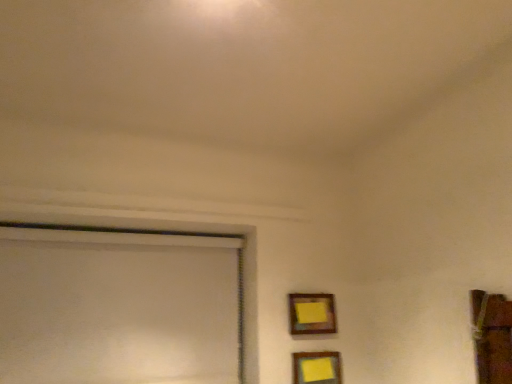
Find the location of a particular element. This screenshot has width=512, height=384. wooden frame at lower right, positioned as the 2th picture frame in bottom-to-top order is located at coordinates (312, 314).

The width and height of the screenshot is (512, 384). What do you see at coordinates (312, 314) in the screenshot?
I see `wooden frame at lower right, positioned as the 2th picture frame in bottom-to-top order` at bounding box center [312, 314].

Describe the element at coordinates (317, 368) in the screenshot. I see `wooden framed picture at lower center, marked as the second picture frame in a top-to-bottom arrangement` at that location.

Find the location of a particular element. wooden framed picture at lower center, the 1th picture frame positioned from the bottom is located at coordinates click(x=317, y=368).

Based on the photo, what is the approximate width of wooden framed picture at lower center, marked as the second picture frame in a top-to-bottom arrangement?

wooden framed picture at lower center, marked as the second picture frame in a top-to-bottom arrangement, is 1.39 inches in width.

The image size is (512, 384). Find the location of `wooden frame at lower right, the 1th picture frame viewed from the top`. wooden frame at lower right, the 1th picture frame viewed from the top is located at coordinates (312, 314).

In the image, is wooden frame at lower right, positioned as the 2th picture frame in bottom-to-top order, on the left side or the right side of wooden framed picture at lower center, marked as the second picture frame in a top-to-bottom arrangement?

From the image, it's evident that wooden frame at lower right, positioned as the 2th picture frame in bottom-to-top order, is to the left of wooden framed picture at lower center, marked as the second picture frame in a top-to-bottom arrangement.

Does wooden frame at lower right, the 1th picture frame viewed from the top, lie in front of wooden framed picture at lower center, marked as the second picture frame in a top-to-bottom arrangement?

No.

Between point (314, 307) and point (313, 361), which one is positioned in front?

Positioned in front is point (313, 361).

From the image's perspective, which one is positioned lower, wooden frame at lower right, the 1th picture frame viewed from the top, or wooden framed picture at lower center, marked as the second picture frame in a top-to-bottom arrangement?

wooden framed picture at lower center, marked as the second picture frame in a top-to-bottom arrangement, appears lower in the image.

From a real-world perspective, between wooden frame at lower right, positioned as the 2th picture frame in bottom-to-top order, and wooden framed picture at lower center, marked as the second picture frame in a top-to-bottom arrangement, who is vertically lower?

wooden framed picture at lower center, marked as the second picture frame in a top-to-bottom arrangement, from a real-world perspective.

Can you confirm if wooden frame at lower right, positioned as the 2th picture frame in bottom-to-top order, is wider than wooden framed picture at lower center, the 1th picture frame positioned from the bottom?

In fact, wooden frame at lower right, positioned as the 2th picture frame in bottom-to-top order, might be narrower than wooden framed picture at lower center, the 1th picture frame positioned from the bottom.

Who is taller, wooden frame at lower right, positioned as the 2th picture frame in bottom-to-top order, or wooden framed picture at lower center, marked as the second picture frame in a top-to-bottom arrangement?

wooden frame at lower right, positioned as the 2th picture frame in bottom-to-top order.

Who is bigger, wooden frame at lower right, the 1th picture frame viewed from the top, or wooden framed picture at lower center, marked as the second picture frame in a top-to-bottom arrangement?

Bigger between the two is wooden framed picture at lower center, marked as the second picture frame in a top-to-bottom arrangement.

Consider the image. Would you say wooden framed picture at lower center, marked as the second picture frame in a top-to-bottom arrangement, is part of wooden frame at lower right, positioned as the 2th picture frame in bottom-to-top order,'s contents?

Definitely not — wooden framed picture at lower center, marked as the second picture frame in a top-to-bottom arrangement, is not inside wooden frame at lower right, positioned as the 2th picture frame in bottom-to-top order.

Would you consider wooden frame at lower right, positioned as the 2th picture frame in bottom-to-top order, to be distant from wooden framed picture at lower center, marked as the second picture frame in a top-to-bottom arrangement?

Actually, wooden frame at lower right, positioned as the 2th picture frame in bottom-to-top order, and wooden framed picture at lower center, marked as the second picture frame in a top-to-bottom arrangement, are a little close together.

Is wooden frame at lower right, positioned as the 2th picture frame in bottom-to-top order, oriented away from wooden framed picture at lower center, marked as the second picture frame in a top-to-bottom arrangement?

No, wooden frame at lower right, positioned as the 2th picture frame in bottom-to-top order, is not facing the opposite direction of wooden framed picture at lower center, marked as the second picture frame in a top-to-bottom arrangement.

What's the angular difference between wooden frame at lower right, positioned as the 2th picture frame in bottom-to-top order, and wooden framed picture at lower center, the 1th picture frame positioned from the bottom,'s facing directions?

0.0037 degrees.

The width and height of the screenshot is (512, 384). Identify the location of picture frame to the right of wooden frame at lower right, the 1th picture frame viewed from the top. (317, 368).

Is wooden framed picture at lower center, marked as the second picture frame in a top-to-bottom arrangement, at the right side of wooden frame at lower right, positioned as the 2th picture frame in bottom-to-top order?

Correct, you'll find wooden framed picture at lower center, marked as the second picture frame in a top-to-bottom arrangement, to the right of wooden frame at lower right, positioned as the 2th picture frame in bottom-to-top order.

Between wooden framed picture at lower center, the 1th picture frame positioned from the bottom, and wooden frame at lower right, positioned as the 2th picture frame in bottom-to-top order, which one is positioned in front?

wooden framed picture at lower center, the 1th picture frame positioned from the bottom, is in front.

Between point (295, 356) and point (328, 308), which one is positioned behind?

The point (328, 308) is more distant.

From the image's perspective, would you say wooden framed picture at lower center, the 1th picture frame positioned from the bottom, is shown under wooden frame at lower right, the 1th picture frame viewed from the top?

Yes, from the image's perspective, wooden framed picture at lower center, the 1th picture frame positioned from the bottom, is beneath wooden frame at lower right, the 1th picture frame viewed from the top.

From a real-world perspective, is wooden framed picture at lower center, marked as the second picture frame in a top-to-bottom arrangement, positioned above or below wooden frame at lower right, the 1th picture frame viewed from the top?

wooden framed picture at lower center, marked as the second picture frame in a top-to-bottom arrangement, is situated lower than wooden frame at lower right, the 1th picture frame viewed from the top, in the real world.

Does wooden framed picture at lower center, the 1th picture frame positioned from the bottom, have a greater width compared to wooden frame at lower right, positioned as the 2th picture frame in bottom-to-top order?

Yes.

From their relative heights in the image, would you say wooden framed picture at lower center, the 1th picture frame positioned from the bottom, is taller or shorter than wooden frame at lower right, the 1th picture frame viewed from the top?

Clearly, wooden framed picture at lower center, the 1th picture frame positioned from the bottom, is shorter compared to wooden frame at lower right, the 1th picture frame viewed from the top.

Considering the sizes of objects wooden framed picture at lower center, the 1th picture frame positioned from the bottom, and wooden frame at lower right, positioned as the 2th picture frame in bottom-to-top order, in the image provided, who is bigger, wooden framed picture at lower center, the 1th picture frame positioned from the bottom, or wooden frame at lower right, positioned as the 2th picture frame in bottom-to-top order,?

Bigger between the two is wooden framed picture at lower center, the 1th picture frame positioned from the bottom.

Would you say wooden framed picture at lower center, marked as the second picture frame in a top-to-bottom arrangement, contains wooden frame at lower right, the 1th picture frame viewed from the top?

Actually, wooden frame at lower right, the 1th picture frame viewed from the top, is outside wooden framed picture at lower center, marked as the second picture frame in a top-to-bottom arrangement.

Would you consider wooden framed picture at lower center, marked as the second picture frame in a top-to-bottom arrangement, to be distant from wooden frame at lower right, positioned as the 2th picture frame in bottom-to-top order?

No, there isn't a large distance between wooden framed picture at lower center, marked as the second picture frame in a top-to-bottom arrangement, and wooden frame at lower right, positioned as the 2th picture frame in bottom-to-top order.

Is wooden framed picture at lower center, marked as the second picture frame in a top-to-bottom arrangement, facing towards wooden frame at lower right, positioned as the 2th picture frame in bottom-to-top order?

No, wooden framed picture at lower center, marked as the second picture frame in a top-to-bottom arrangement, does not turn towards wooden frame at lower right, positioned as the 2th picture frame in bottom-to-top order.

What's the angular difference between wooden framed picture at lower center, the 1th picture frame positioned from the bottom, and wooden frame at lower right, the 1th picture frame viewed from the top,'s facing directions?

The angular difference between wooden framed picture at lower center, the 1th picture frame positioned from the bottom, and wooden frame at lower right, the 1th picture frame viewed from the top, is 0.0037 degrees.

Identify the location of picture frame above the wooden framed picture at lower center, marked as the second picture frame in a top-to-bottom arrangement (from a real-world perspective). (312, 314).

Identify the location of picture frame above the wooden framed picture at lower center, marked as the second picture frame in a top-to-bottom arrangement (from a real-world perspective). Image resolution: width=512 pixels, height=384 pixels. (312, 314).

Identify the location of picture frame that appears on the right of wooden frame at lower right, the 1th picture frame viewed from the top. The height and width of the screenshot is (384, 512). (317, 368).